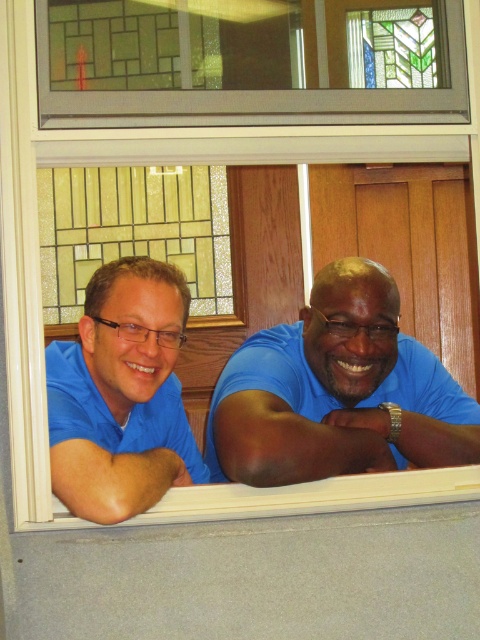
You are a photographer trying to capture a shot of the stained glass window at upper center and the matte blue arm at lower left. Which object is located to the right of the other?

The stained glass window at upper center is positioned on the right side of matte blue arm at lower left.

You are a photographer trying to capture a closeup of the blue smooth shirt at lower right and the matte blue arm at lower left through the window. Which object should you focus on first if you want to ensure both are in focus without adjusting the camera settings?

The blue smooth shirt at lower right is taller than the matte blue arm at lower left. To keep both in focus, focus on the blue smooth shirt at lower right first since it is farther away, as depth of field typically extends further behind the point of focus than in front.

You are a photographer trying to capture a candid shot of the two people leaning out the window. You want to ensure that the blue smooth shirt at lower right and the matte blue arm at lower left are both visible in the frame. Based on their positions, which object should you focus on first to include both in the shot?

The blue smooth shirt at lower right is to the right of the matte blue arm at lower left. To include both in the shot, focus on the matte blue arm at lower left first, then adjust the frame to include the blue smooth shirt at lower right which is positioned further to the right.